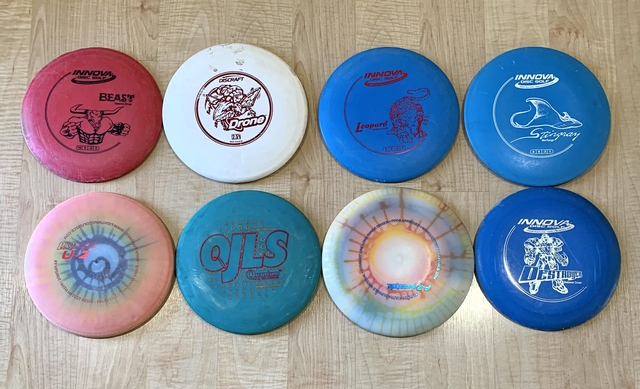
I want to click on beige wooden floor, so click(x=312, y=189).